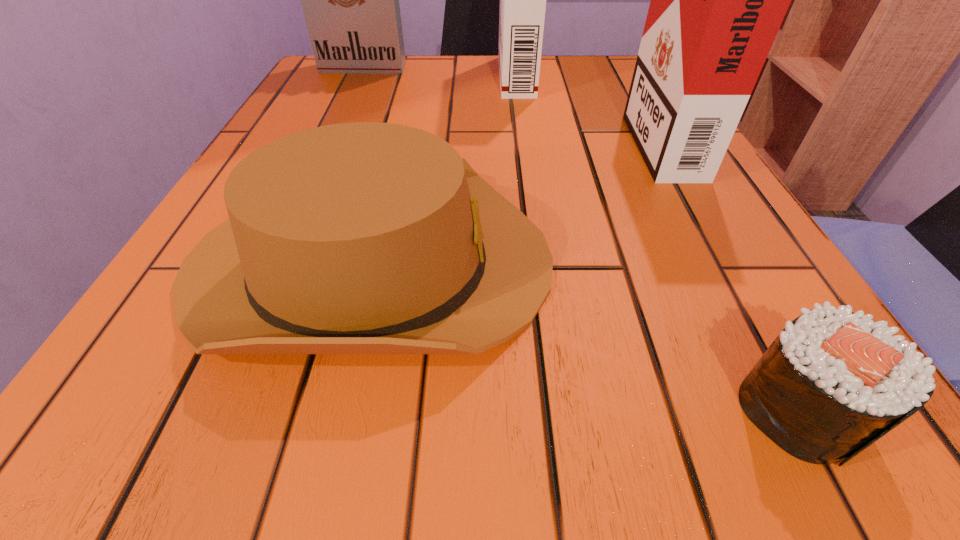
Locate an element on the screen. The image size is (960, 540). the second cigarette case from right to left is located at coordinates (522, 0).

What are the coordinates of `the leftmost cigarette case` in the screenshot? It's located at (350, 0).

Where is `the rightmost cigarette case`? The image size is (960, 540). the rightmost cigarette case is located at coordinates (718, 0).

The width and height of the screenshot is (960, 540). Identify the location of cowboy hat. (355, 238).

The image size is (960, 540). I want to click on sushi, so click(x=832, y=383).

The width and height of the screenshot is (960, 540). Identify the location of vacant space positioned on the front-facing side of the second cigarette case from right to left. (349, 77).

Identify the location of free space located 0.210m on the front-facing side of the second cigarette case from right to left. The height and width of the screenshot is (540, 960). (404, 77).

I want to click on free space located 0.080m on the front-facing side of the second cigarette case from right to left, so click(x=464, y=77).

You are a GUI agent. You are given a task and a screenshot of the screen. Output one action in this format:
    pyautogui.click(x=<x>, y=<y>)
    Task: Click on the vacant space located 0.280m with the lid open on the leftmost cigarette case
    The height and width of the screenshot is (540, 960).
    Given the screenshot: What is the action you would take?
    pyautogui.click(x=331, y=136)

I want to click on vacant point located on the front-facing side of the nearest cigarette case, so click(577, 139).